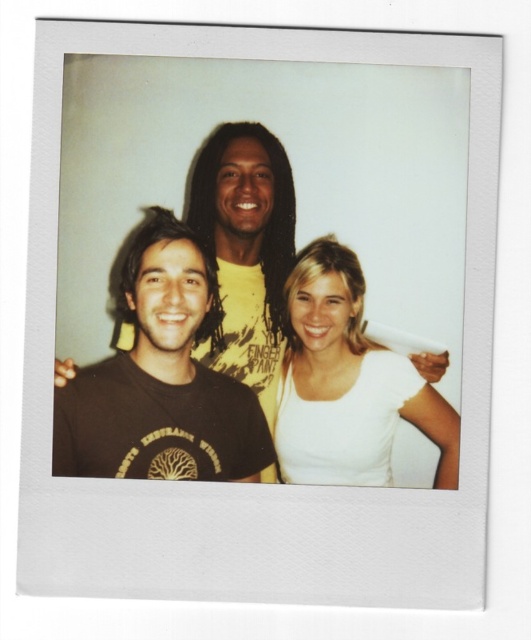
Question: Which object is closer to the camera taking this photo?

Choices:
 (A) white matte shirt at center
 (B) black matte t-shirt at center

Answer: (A)

Question: Is white matte shirt at center above black matte t-shirt at center?

Choices:
 (A) yes
 (B) no

Answer: (B)

Question: Which point is farther to the camera?

Choices:
 (A) (301, 348)
 (B) (107, 362)

Answer: (A)

Question: Can you confirm if white matte shirt at center is positioned below black matte t-shirt at center?

Choices:
 (A) yes
 (B) no

Answer: (A)

Question: Does white matte shirt at center have a smaller size compared to black matte t-shirt at center?

Choices:
 (A) yes
 (B) no

Answer: (B)